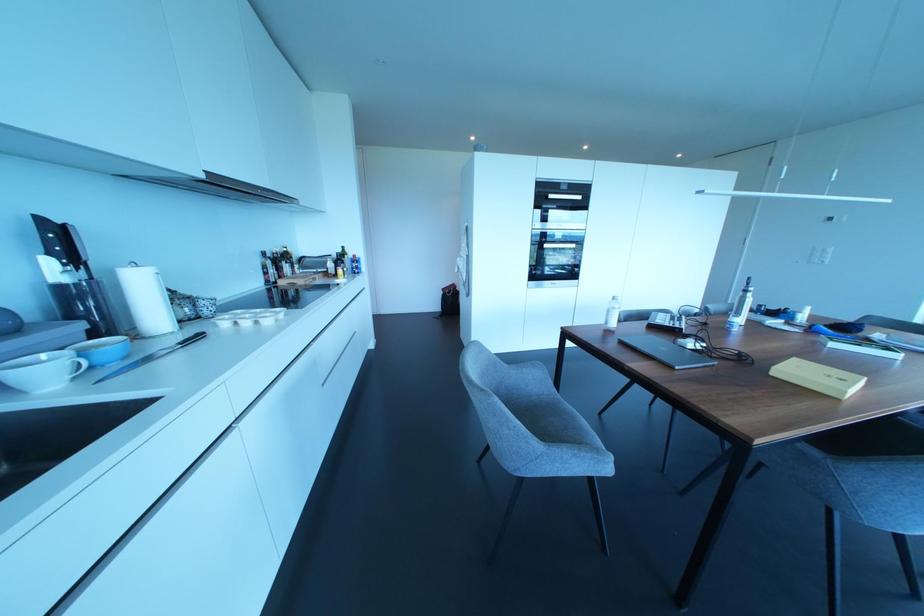
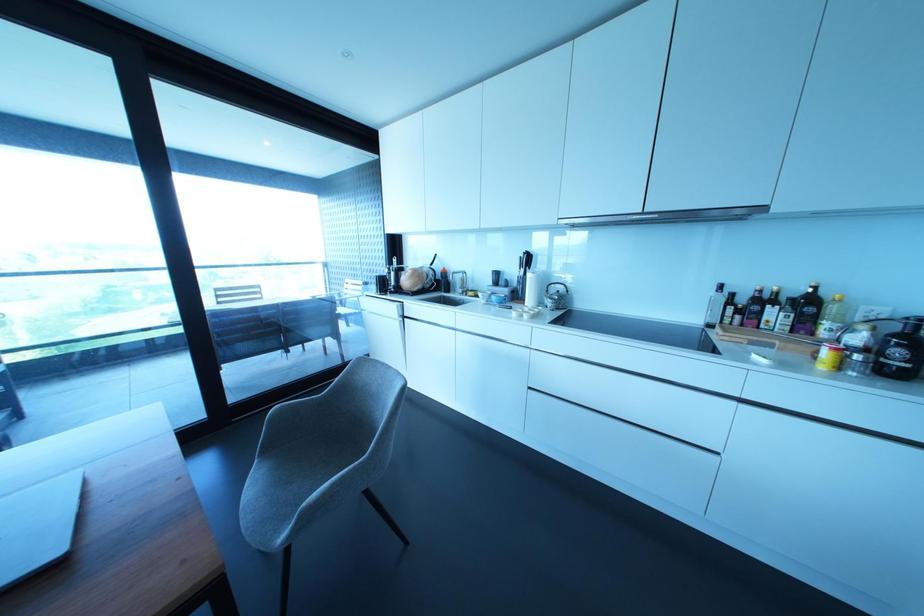
Find the pixel in the second image that matches (296,265) in the first image.

(825, 323)